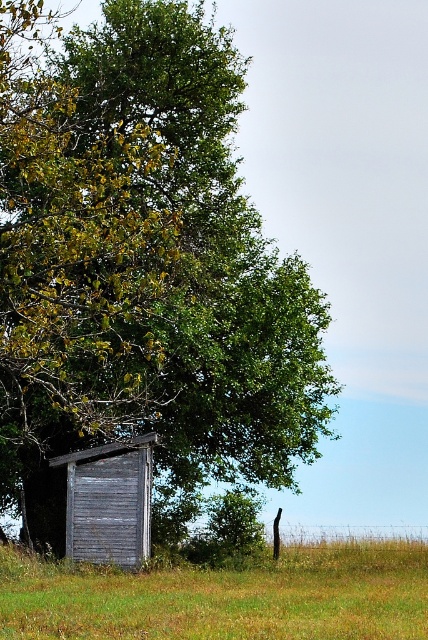
Looking at this image, you are a gardener who needs to water the green leafy tree at upper left and the weathered wood shed at lower left. Your hose can reach up to 3 meters. Can you water both without moving the hose?

The distance between the green leafy tree at upper left and the weathered wood shed at lower left is 3.19 meters. Since the hose can only reach up to 3 meters, you cannot water both without moving the hose.

You are standing at the point marked as point (222, 596) in the image. What is the object directly beneath your feet?

The green grass at lower center is located at point (222, 596), so the object directly beneath your feet is the green grass at lower center.